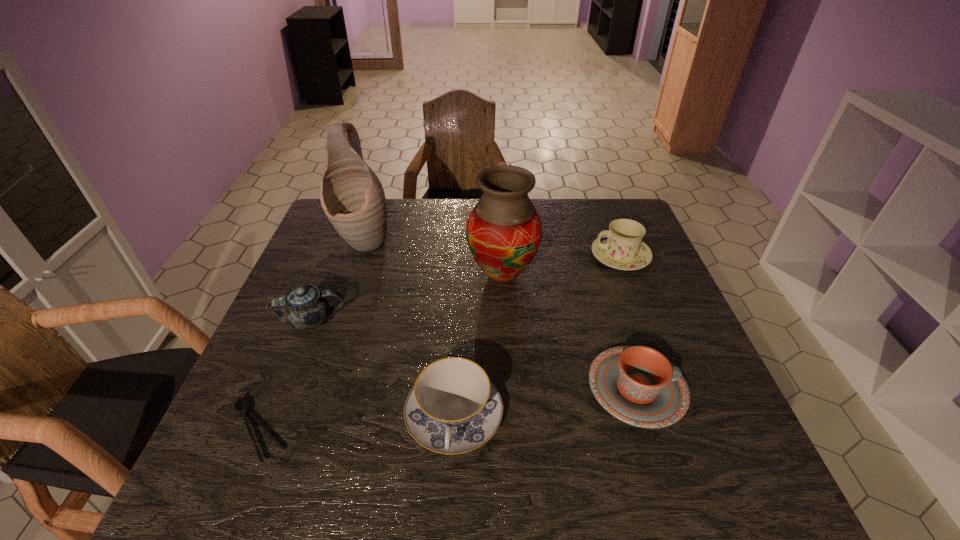
What are the coordinates of `unoccupied position between the tallest object and the second tallest object` in the screenshot? It's located at (433, 258).

Identify the location of vacant area that lies between the third nearest chinaware and the vase. This screenshot has width=960, height=540. (407, 298).

Find the location of a particular element. Image resolution: width=960 pixels, height=540 pixels. vacant space that is in between the vase and the shortest object is located at coordinates (379, 353).

I want to click on object that is the second closest to the shortest object, so click(x=453, y=408).

This screenshot has height=540, width=960. Find the location of `the fifth closest object to the farthest chinaware`. the fifth closest object to the farthest chinaware is located at coordinates (305, 307).

Identify the location of the third closest chinaware to the second chinaware from left to right. The width and height of the screenshot is (960, 540). (621, 247).

Locate which chinaware is the third closest to the farthest chinaware. Please provide its 2D coordinates. Your answer should be formatted as a tuple, i.e. [(x, y)], where the tuple contains the x and y coordinates of a point satisfying the conditions above.

[(305, 307)]

I want to click on free location that satisfies the following two spatial constraints: 1. on the handle side of the shortest chinaware; 2. on the front side of the shortest object, so click(650, 430).